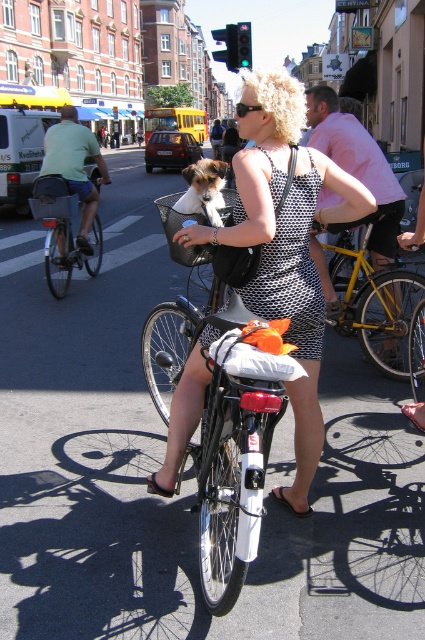
Question: Can you confirm if black matte bicycle at center is positioned to the right of matte black bicycle at left?

Choices:
 (A) yes
 (B) no

Answer: (A)

Question: Which object is the closest to the black matte bicycle at center?

Choices:
 (A) soft brown fur at center
 (B) polka dot dress at center
 (C) pink fabric shirt at upper right
 (D) yellow metallic bicycle at center-right

Answer: (B)

Question: Which of these objects is positioned farthest from the black dotted dress at center?

Choices:
 (A) black matte bicycle at center
 (B) yellow metallic bicycle at center-right
 (C) pink fabric shirt at upper right

Answer: (C)

Question: Is black matte bicycle at center below yellow metallic bicycle at center-right?

Choices:
 (A) no
 (B) yes

Answer: (B)

Question: Does black dotted dress at center appear over yellow metallic bicycle at center-right?

Choices:
 (A) no
 (B) yes

Answer: (A)

Question: Which of these objects is positioned farthest from the black mesh basket at center?

Choices:
 (A) matte black bicycle at left
 (B) pink fabric shirt at upper right
 (C) soft brown fur at center
 (D) black dotted dress at center

Answer: (B)